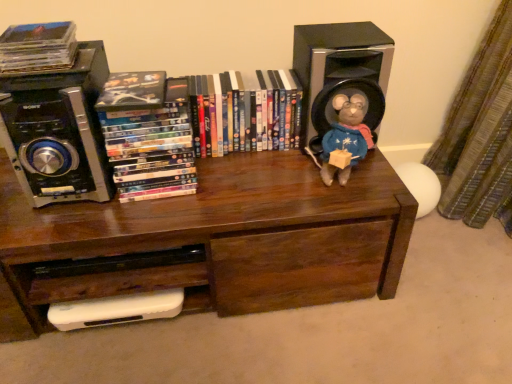
The height and width of the screenshot is (384, 512). Find the location of `unoccupied area in front of matte plastic dvds at center, marked as the first book in a right-to-left arrangement`. unoccupied area in front of matte plastic dvds at center, marked as the first book in a right-to-left arrangement is located at coordinates (248, 181).